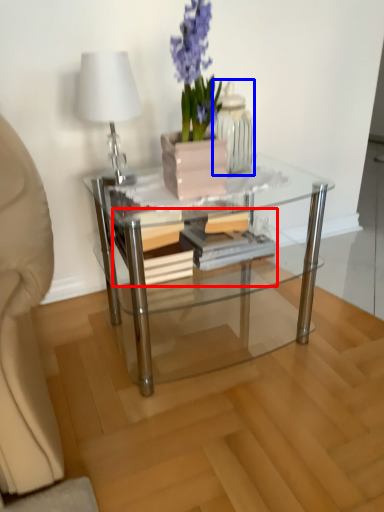
Question: Which object appears closest to the camera in this image, book (highlighted by a red box) or glass vase (highlighted by a blue box)?

Choices:
 (A) book
 (B) glass vase

Answer: (B)